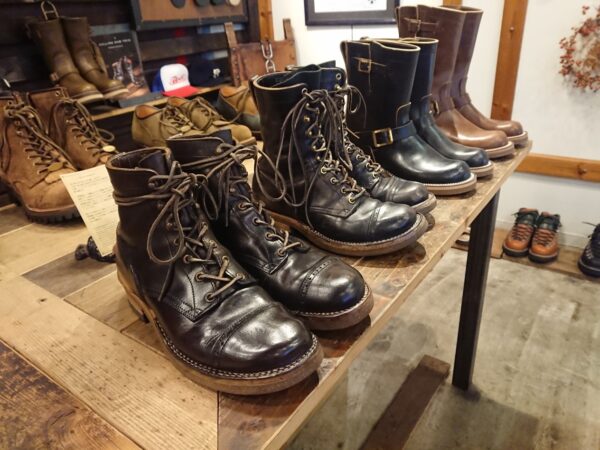
Find the location of a particular element. Image resolution: width=600 pixels, height=450 pixels. the front right table leg is located at coordinates (481, 280).